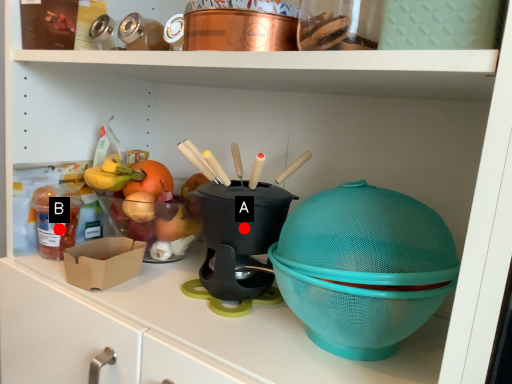
Question: Two points are circled on the image, labeled by A and B beside each circle. Among these points, which one is farthest from the camera?

Choices:
 (A) A is further
 (B) B is further

Answer: (B)